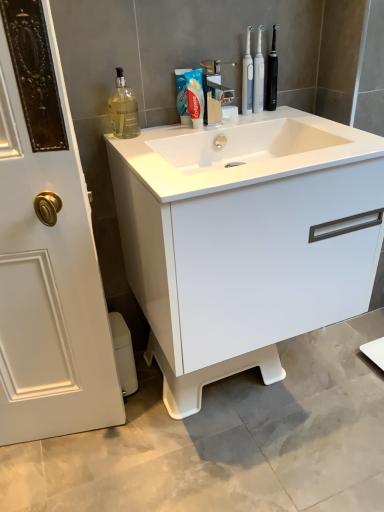
The height and width of the screenshot is (512, 384). Find the location of `vacant space in between white matte toothpaste at center and translucent glass bottle at upper left`. vacant space in between white matte toothpaste at center and translucent glass bottle at upper left is located at coordinates (160, 130).